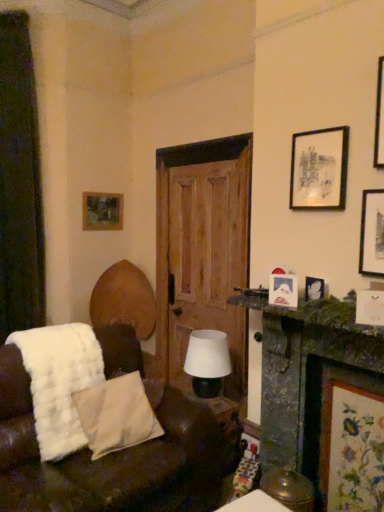
Question: Considering the relative sizes of white fluffy blanket at lower left and white matte table lamp at center in the image provided, is white fluffy blanket at lower left bigger than white matte table lamp at center?

Choices:
 (A) yes
 (B) no

Answer: (A)

Question: Is white fluffy blanket at lower left oriented towards white matte table lamp at center?

Choices:
 (A) no
 (B) yes

Answer: (A)

Question: Can you confirm if white fluffy blanket at lower left is thinner than white matte table lamp at center?

Choices:
 (A) yes
 (B) no

Answer: (B)

Question: Considering the relative positions of white fluffy blanket at lower left and white matte table lamp at center in the image provided, is white fluffy blanket at lower left in front of white matte table lamp at center?

Choices:
 (A) no
 (B) yes

Answer: (B)

Question: Considering the relative sizes of white fluffy blanket at lower left and white matte table lamp at center in the image provided, is white fluffy blanket at lower left wider than white matte table lamp at center?

Choices:
 (A) no
 (B) yes

Answer: (B)

Question: From a real-world perspective, is green mossy stone mantelpiece at right above or below black matte picture frame at upper right, which appears as the fourth picture frame when viewed from the back?

Choices:
 (A) above
 (B) below

Answer: (B)

Question: Considering the positions of point (294, 315) and point (292, 175), is point (294, 315) closer or farther from the camera than point (292, 175)?

Choices:
 (A) farther
 (B) closer

Answer: (B)

Question: Considering the positions of green mossy stone mantelpiece at right and black matte picture frame at upper right, which ranks as the 1th picture frame in top-to-bottom order, in the image, is green mossy stone mantelpiece at right wider or thinner than black matte picture frame at upper right, which ranks as the 1th picture frame in top-to-bottom order,?

Choices:
 (A) wide
 (B) thin

Answer: (A)

Question: Considering their positions, is green mossy stone mantelpiece at right located in front of or behind black matte picture frame at upper right, which ranks as the 1th picture frame in top-to-bottom order?

Choices:
 (A) behind
 (B) front

Answer: (B)

Question: Visually, is white matte table lamp at center positioned to the left or to the right of wooden door at center?

Choices:
 (A) right
 (B) left

Answer: (A)

Question: Based on their sizes in the image, would you say white matte table lamp at center is bigger or smaller than wooden door at center?

Choices:
 (A) big
 (B) small

Answer: (B)

Question: Is point (215, 338) positioned closer to the camera than point (160, 264)?

Choices:
 (A) farther
 (B) closer

Answer: (B)

Question: From a real-world perspective, is white matte table lamp at center positioned above or below wooden door at center?

Choices:
 (A) above
 (B) below

Answer: (B)

Question: Is white fluffy blanket at lower left in front of or behind white soft pillow at lower left in the image?

Choices:
 (A) behind
 (B) front

Answer: (B)

Question: Visually, is white fluffy blanket at lower left positioned to the left or to the right of white soft pillow at lower left?

Choices:
 (A) left
 (B) right

Answer: (A)